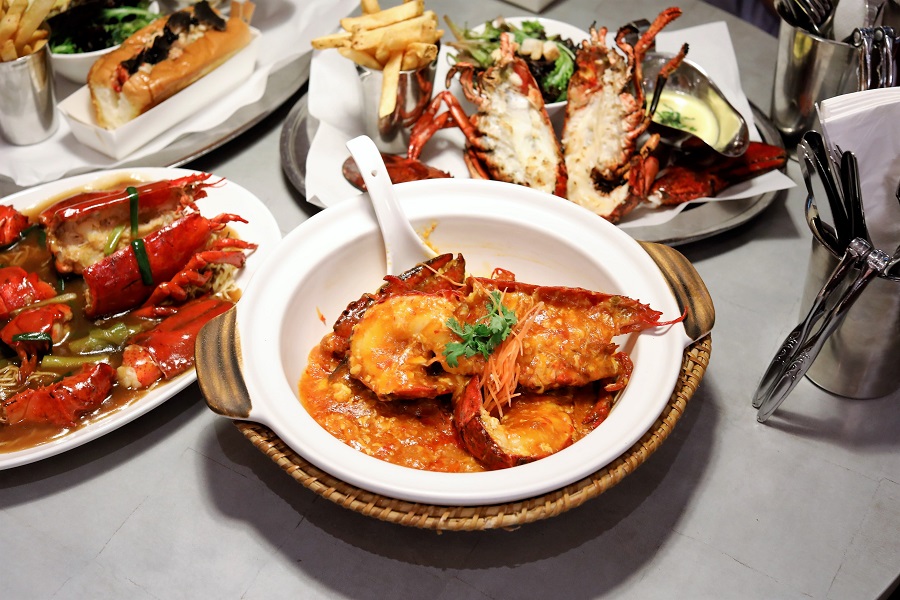
Find the location of a particular element. The image size is (900, 600). plate is located at coordinates (136, 413), (324, 125), (245, 112).